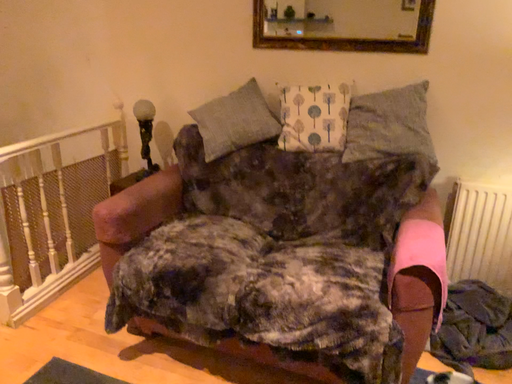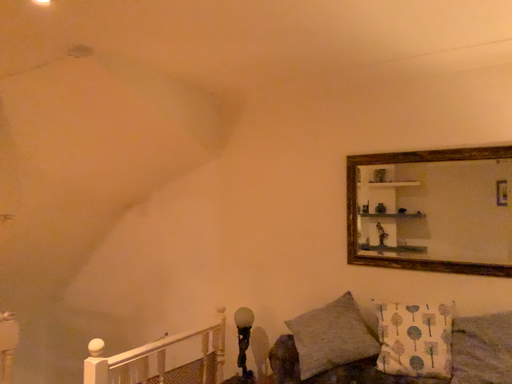
Question: Which way did the camera rotate in the video?

Choices:
 (A) rotated downward
 (B) rotated upward

Answer: (B)